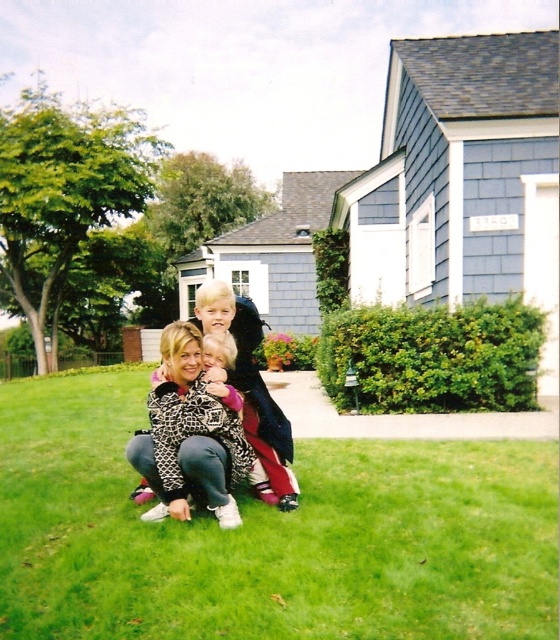
Is green grass at lower center wider than leopard print jacket at center?

Correct, the width of green grass at lower center exceeds that of leopard print jacket at center.

Between point (446, 621) and point (292, 492), which one is positioned in front?

Point (446, 621) is more forward.

Between point (552, 625) and point (274, 486), which one is positioned behind?

Point (274, 486)

At what (x,y) coordinates should I click in order to perform the action: click on green grass at lower center. Please return your answer as a coordinate pair (x, y). The width and height of the screenshot is (560, 640). Looking at the image, I should click on (268, 534).